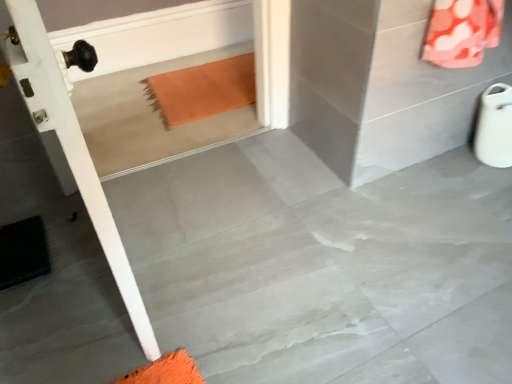
Question: Is orange fabric at upper right bigger or smaller than black rubber doormat at lower left?

Choices:
 (A) big
 (B) small

Answer: (A)

Question: From a real-world perspective, is orange fabric at upper right physically located above or below black rubber doormat at lower left?

Choices:
 (A) above
 (B) below

Answer: (A)

Question: Estimate the real-world distances between objects in this image. Which object is closer to the orange fabric at upper right?

Choices:
 (A) black rubber doormat at lower left
 (B) gray polished concrete at center

Answer: (B)

Question: Which object is the closest to the black rubber doormat at lower left?

Choices:
 (A) gray polished concrete at center
 (B) orange fabric at upper right

Answer: (A)